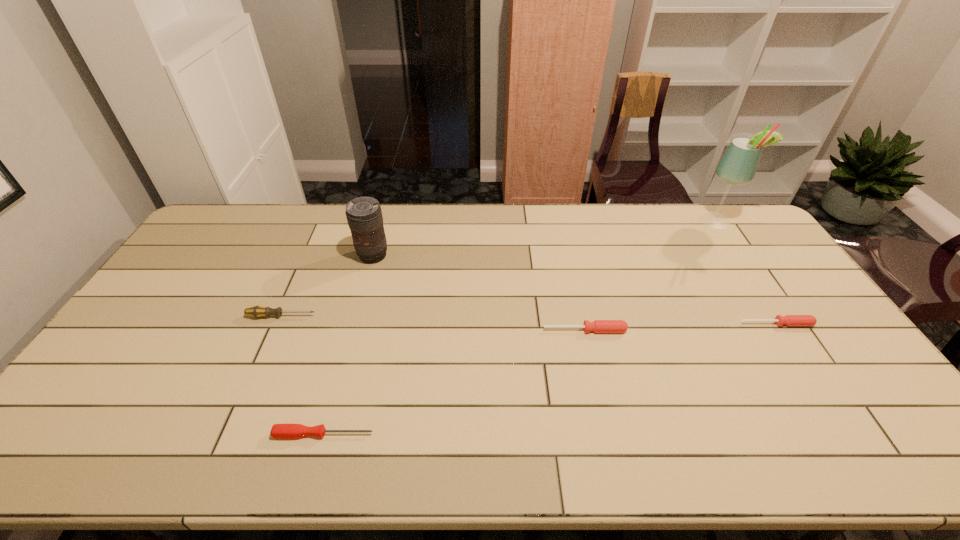
In order to click on alcohol in this screenshot , I will do `click(738, 165)`.

What are the coordinates of `the tallest object` in the screenshot? It's located at (738, 165).

The width and height of the screenshot is (960, 540). Find the location of `telephoto lens`. telephoto lens is located at coordinates (364, 216).

Find the location of a particular element. The height and width of the screenshot is (540, 960). the second tallest object is located at coordinates (364, 216).

Where is `the leftmost screwdriver`? the leftmost screwdriver is located at coordinates (257, 311).

The width and height of the screenshot is (960, 540). In order to click on the fourth object from left to right in this screenshot , I will do pyautogui.click(x=598, y=326).

This screenshot has width=960, height=540. Find the location of `the rightmost screwdriver`. the rightmost screwdriver is located at coordinates (789, 320).

Image resolution: width=960 pixels, height=540 pixels. Identify the location of the nearest object. (278, 431).

The height and width of the screenshot is (540, 960). Find the location of `the nearest screwdriver`. the nearest screwdriver is located at coordinates (278, 431).

What are the coordinates of `free point located on the front of the farthest object` in the screenshot? It's located at (744, 263).